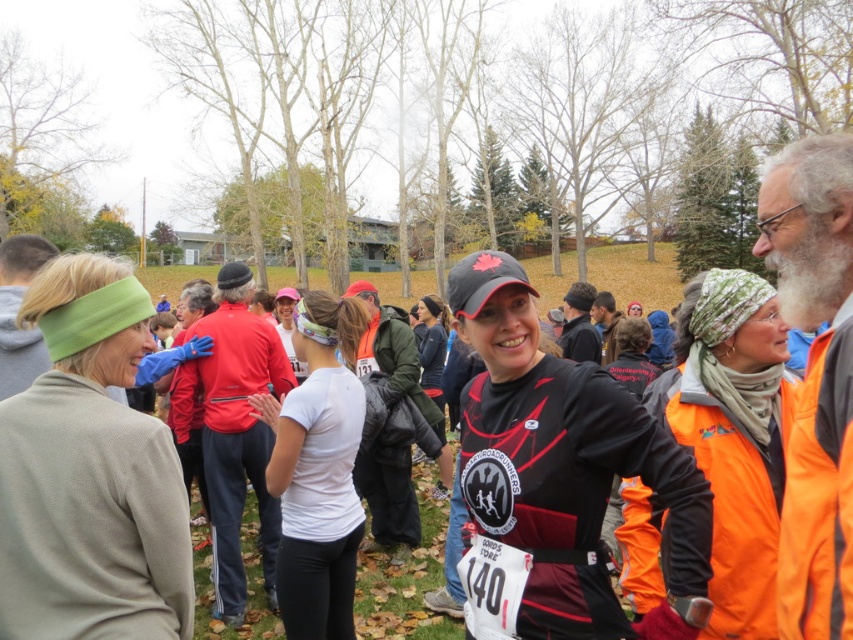
Looking at this image, which of these two, black matte running shirt at center or white matte t-shirt at center, stands shorter?

black matte running shirt at center is shorter.

Can you confirm if black matte running shirt at center is bigger than white matte t-shirt at center?

Incorrect, black matte running shirt at center is not larger than white matte t-shirt at center.

Is point (579, 451) less distant than point (357, 381)?

Yes, point (579, 451) is in front of point (357, 381).

Image resolution: width=853 pixels, height=640 pixels. Identify the location of black matte running shirt at center. (558, 474).